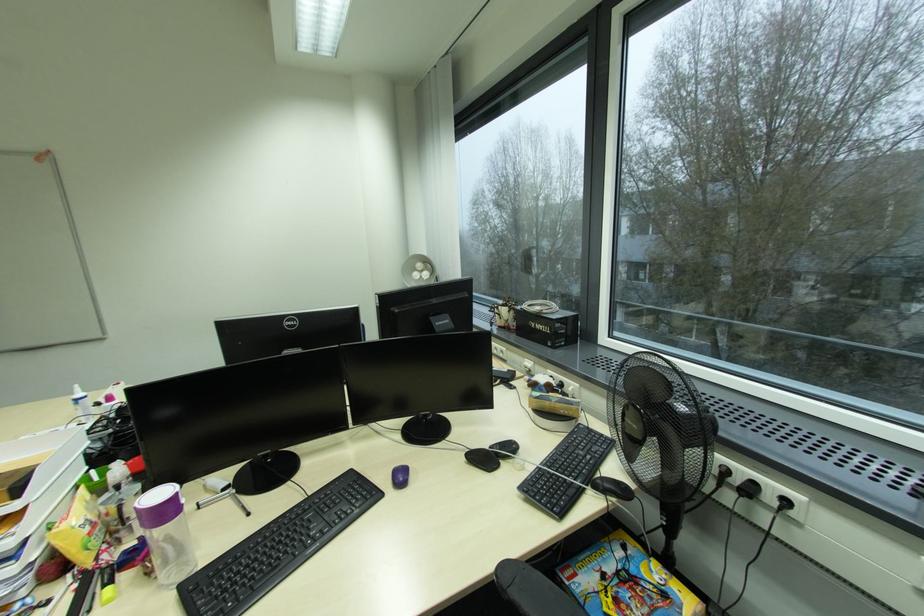
Find the location of a particular element. This screenshot has height=616, width=924. chair armrest is located at coordinates (532, 591).